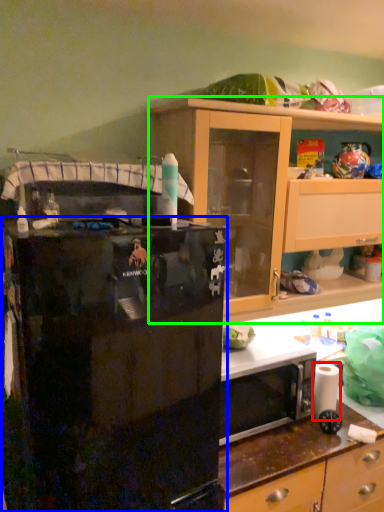
Question: Based on their relative distances, which object is nearer to toilet paper (highlighted by a red box)? Choose from refrigerator (highlighted by a blue box) and cabinetry (highlighted by a green box).

Choices:
 (A) refrigerator
 (B) cabinetry

Answer: (B)